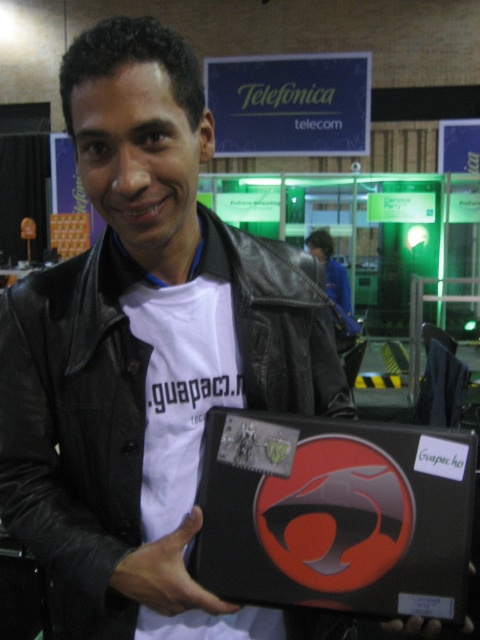
Is point (283, 305) closer to camera compared to point (127, 577)?

No, it is not.

The height and width of the screenshot is (640, 480). I want to click on black leather jacket at center, so click(72, 436).